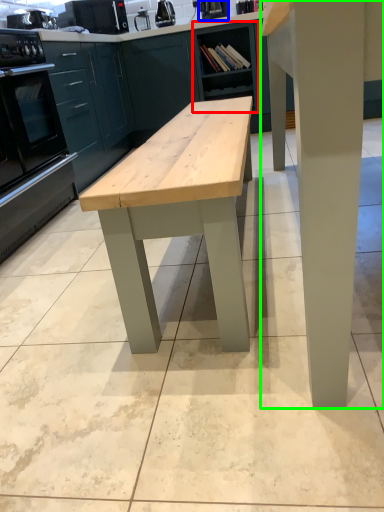
Question: Which object is positioned closest to cabinetry (highlighted by a red box)? Select from appliance (highlighted by a blue box) and table (highlighted by a green box).

Choices:
 (A) appliance
 (B) table

Answer: (A)